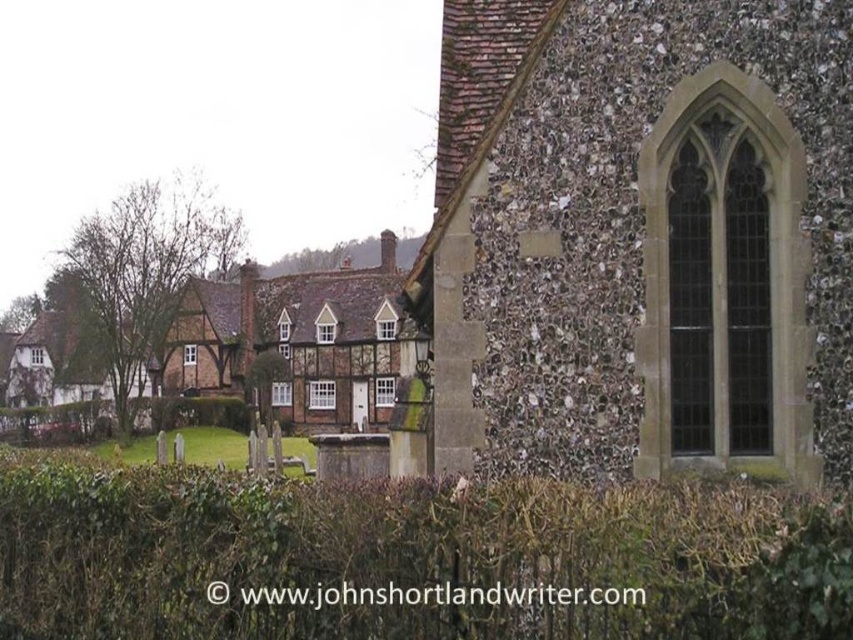
Question: Can you confirm if speckled stone church at center is positioned to the right of green leafy hedge at center?

Choices:
 (A) no
 (B) yes

Answer: (B)

Question: Among these points, which one is nearest to the camera?

Choices:
 (A) (567, 307)
 (B) (583, 625)

Answer: (B)

Question: Can you confirm if speckled stone church at center is positioned above green leafy hedge at center?

Choices:
 (A) yes
 (B) no

Answer: (A)

Question: Which object is farther from the camera taking this photo?

Choices:
 (A) green leafy hedge at center
 (B) speckled stone church at center

Answer: (B)

Question: Does speckled stone church at center have a greater width compared to green leafy hedge at center?

Choices:
 (A) yes
 (B) no

Answer: (B)